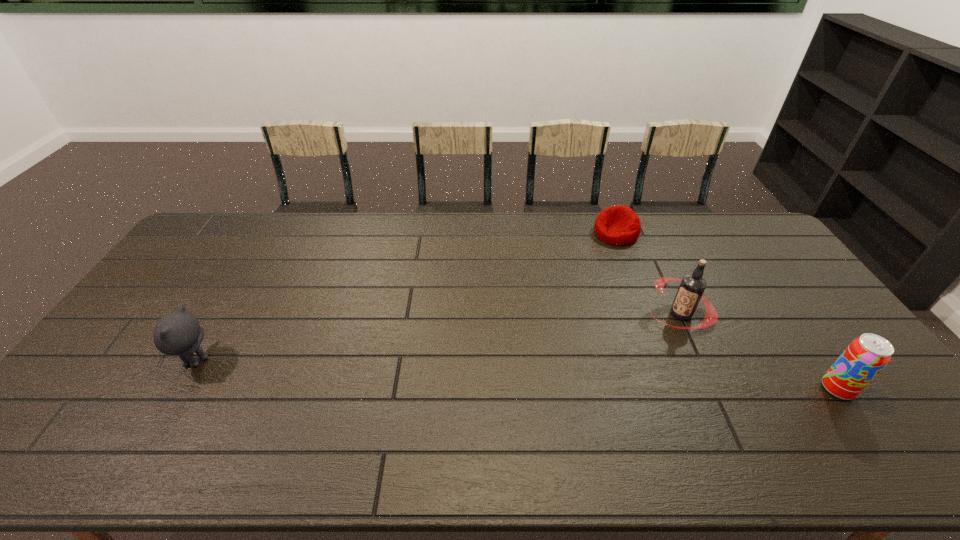
Identify the location of free spot between the shortest object and the leftmost object. The width and height of the screenshot is (960, 540). (405, 296).

Locate an element on the screen. This screenshot has height=540, width=960. free point between the beanbag and the soda can is located at coordinates (727, 311).

Locate an element on the screen. the third closest object relative to the soda can is located at coordinates (179, 333).

Where is `object identified as the second closest to the soda can`? object identified as the second closest to the soda can is located at coordinates (619, 225).